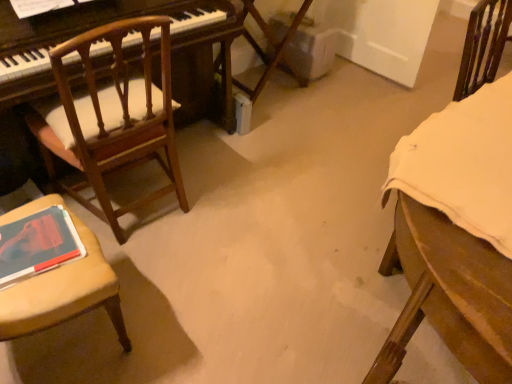
Question: Is wooden chair with cushion at left, marked as the 2th chair in a left-to-right arrangement, at the back of matte red book at lower left?

Choices:
 (A) yes
 (B) no

Answer: (B)

Question: From a real-world perspective, is matte red book at lower left located higher than wooden chair with cushion at left, marked as the 2th chair in a left-to-right arrangement?

Choices:
 (A) no
 (B) yes

Answer: (B)

Question: Considering the relative sizes of matte red book at lower left and wooden chair with cushion at left, marked as the 2th chair in a left-to-right arrangement, in the image provided, is matte red book at lower left shorter than wooden chair with cushion at left, marked as the 2th chair in a left-to-right arrangement,?

Choices:
 (A) no
 (B) yes

Answer: (B)

Question: Is matte red book at lower left positioned in front of wooden chair with cushion at left, marked as the 2th chair in a left-to-right arrangement?

Choices:
 (A) yes
 (B) no

Answer: (A)

Question: Considering the relative sizes of matte red book at lower left and wooden chair with cushion at left, marked as the 2th chair in a left-to-right arrangement, in the image provided, is matte red book at lower left thinner than wooden chair with cushion at left, marked as the 2th chair in a left-to-right arrangement,?

Choices:
 (A) yes
 (B) no

Answer: (A)

Question: Can you confirm if matte red book at lower left is positioned to the right of wooden chair with cushion at left, marked as the 2th chair in a left-to-right arrangement?

Choices:
 (A) yes
 (B) no

Answer: (B)

Question: Can you confirm if wooden chair at right, marked as the first chair in a right-to-left arrangement, is taller than wooden chair with cushion at left, the 3th chair in the right-to-left sequence?

Choices:
 (A) yes
 (B) no

Answer: (B)

Question: From the image's perspective, does wooden chair at right, marked as the first chair in a right-to-left arrangement, appear lower than wooden chair with cushion at left, the 3th chair in the right-to-left sequence?

Choices:
 (A) yes
 (B) no

Answer: (B)

Question: Can you confirm if wooden chair at right, which appears as the third chair when viewed from the left, is wider than wooden chair with cushion at left, the 3th chair in the right-to-left sequence?

Choices:
 (A) yes
 (B) no

Answer: (A)

Question: Is wooden chair with cushion at left, the 3th chair in the right-to-left sequence, at the back of wooden chair at right, which appears as the third chair when viewed from the left?

Choices:
 (A) yes
 (B) no

Answer: (B)

Question: Is wooden chair at right, marked as the first chair in a right-to-left arrangement, closer to camera compared to wooden chair with cushion at left, the 3th chair in the right-to-left sequence?

Choices:
 (A) no
 (B) yes

Answer: (A)

Question: Is wooden chair at right, marked as the first chair in a right-to-left arrangement, to the right of wooden chair with cushion at left, the 3th chair in the right-to-left sequence, from the viewer's perspective?

Choices:
 (A) yes
 (B) no

Answer: (A)

Question: From the image's perspective, is wooden chair with cushion at left, marked as the 2th chair in a left-to-right arrangement, over matte red book at lower left?

Choices:
 (A) yes
 (B) no

Answer: (A)